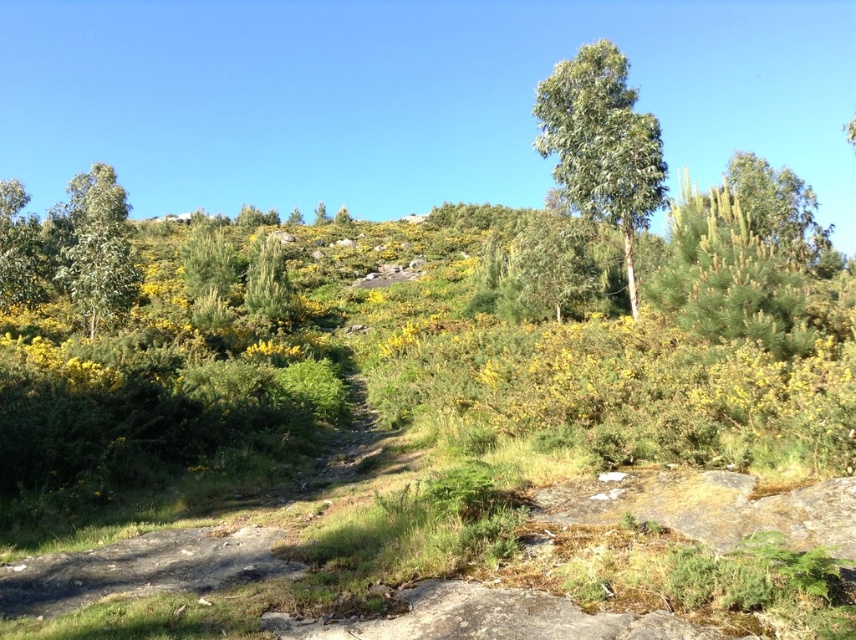
Question: Considering the relative positions of green grassy trail at center and green leafy tree at left in the image provided, where is green grassy trail at center located with respect to green leafy tree at left?

Choices:
 (A) left
 (B) right

Answer: (B)

Question: Which object is farther from the camera taking this photo?

Choices:
 (A) green leafy tree at left
 (B) green grassy trail at center
 (C) green leafy tree at upper center

Answer: (A)

Question: Does green leafy tree at upper center lie in front of green matte tree at upper left?

Choices:
 (A) yes
 (B) no

Answer: (A)

Question: Which object appears farthest from the camera in this image?

Choices:
 (A) green leafy tree at left
 (B) green grassy trail at center

Answer: (A)

Question: Which of these objects is positioned closest to the green leafy tree at left?

Choices:
 (A) green leafy tree at upper center
 (B) green matte tree at upper left
 (C) green grassy trail at center

Answer: (B)

Question: Observing the image, what is the correct spatial positioning of green grassy trail at center in reference to green leafy tree at left?

Choices:
 (A) above
 (B) below

Answer: (B)